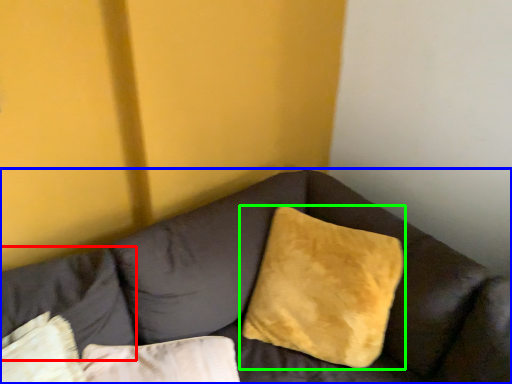
Question: Which object is positioned farthest from pillow (highlighted by a red box)? Select from studio couch (highlighted by a blue box) and pillow (highlighted by a green box).

Choices:
 (A) studio couch
 (B) pillow

Answer: (B)